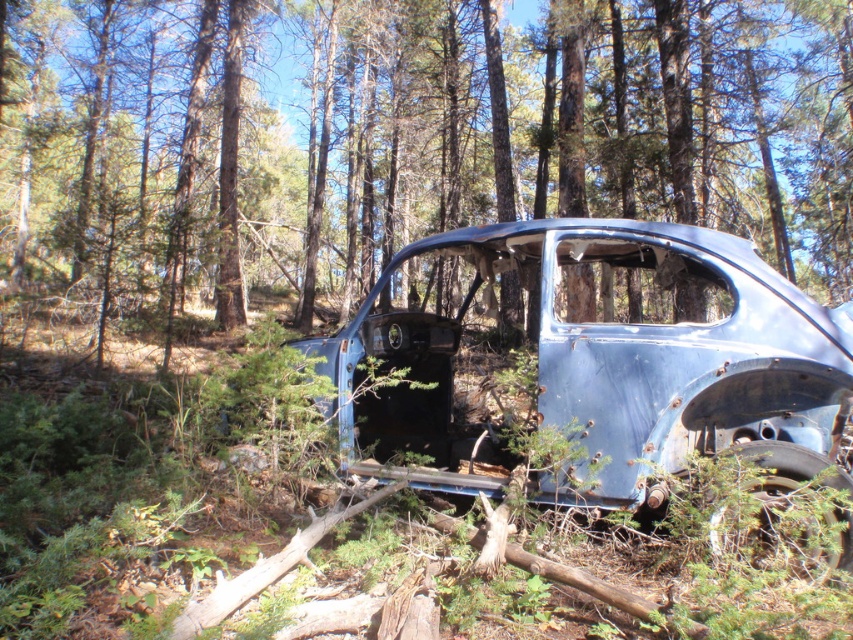
You are standing in a forest and see the blue metallic car at center ahead. If you want to reach the car, how many steps would you need to take if each step covers 2.5 feet?

The blue metallic car at center is 10.79 feet away from viewer. Since each step covers 2.5 feet, you would need approximately 5 steps to reach it.

You are a forest ranger inspecting an abandoned area. You see a blue metallic car at center and a rusty metal car at center. Which car has a greater width?

The blue metallic car at center might be wider than rusty metal car at center, so the blue metallic car at center has a greater width.

Based on the photo, you are standing at point (421, 432) in the forest near the abandoned car. You want to move towards the direction of point (244, 67). Which direction should you move relative to your current position?

You should move backward because point (244, 67) is behind point (421, 432).